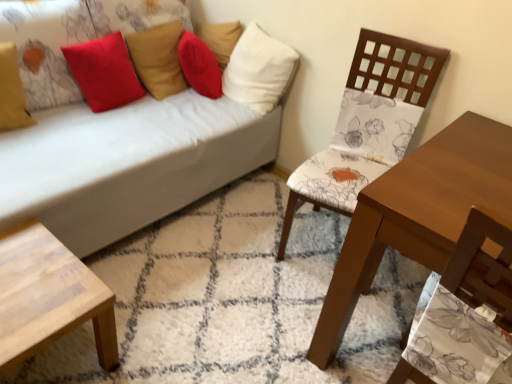
At what (x,y) coordinates should I click in order to perform the action: click on vacant location below light wood/texture coffee table at lower left (from a real-world perspective). Please return your answer as a coordinate pair (x, y). Looking at the image, I should click on (61, 358).